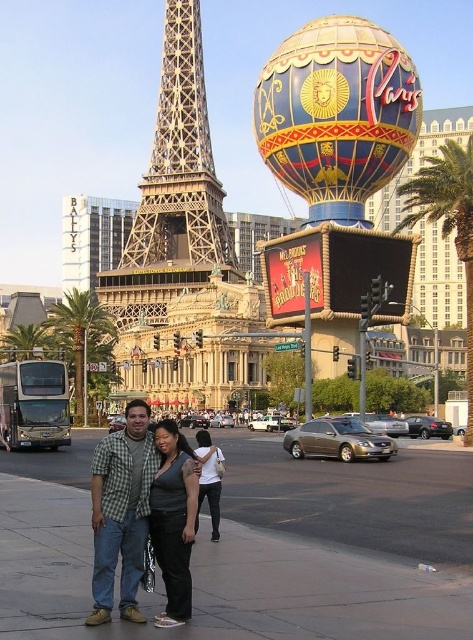
Question: Which is farther from the dark gray fabric shirt at center?

Choices:
 (A) smooth asphalt pavement at center
 (B) green plaid shirt at center

Answer: (A)

Question: Estimate the real-world distances between objects in this image. Which object is farther from the metallic gold eiffel tower at center?

Choices:
 (A) dark gray fabric shirt at center
 (B) green leafy palm tree at right
 (C) green leafy palm tree at center
 (D) smooth asphalt pavement at center

Answer: (A)

Question: Estimate the real-world distances between objects in this image. Which object is farther from the smooth asphalt pavement at center?

Choices:
 (A) green leafy palm tree at right
 (B) metallic gold eiffel tower at center

Answer: (B)

Question: Does green leafy palm tree at right lie behind green leafy palm tree at center?

Choices:
 (A) no
 (B) yes

Answer: (A)

Question: Is smooth asphalt pavement at center in front of blue glossy balloon at upper center?

Choices:
 (A) yes
 (B) no

Answer: (A)

Question: Does green plaid shirt at center lie behind green leafy palm tree at right?

Choices:
 (A) no
 (B) yes

Answer: (A)